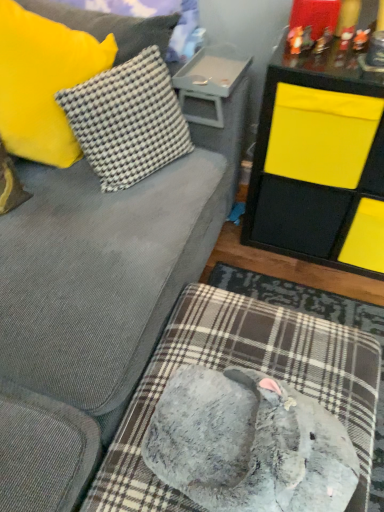
Locate an element on the screen. This screenshot has height=512, width=384. yellow fuzzy pillow at upper left, the 2th pillow positioned from the right is located at coordinates (43, 82).

Image resolution: width=384 pixels, height=512 pixels. What are the coordinates of `yellow matte storage unit at upper right, which is the second table in left-to-right order` in the screenshot? It's located at (319, 162).

The height and width of the screenshot is (512, 384). I want to click on gray plush dog bed at lower center, so click(x=247, y=367).

Based on their sizes in the image, would you say white checkered fabric pillow at upper left, the second pillow viewed from the left, is bigger or smaller than gray plush dog bed at lower center?

Considering their sizes, white checkered fabric pillow at upper left, the second pillow viewed from the left, takes up less space than gray plush dog bed at lower center.

Considering the relative sizes of white checkered fabric pillow at upper left, the 1th pillow positioned from the right, and gray plush dog bed at lower center in the image provided, is white checkered fabric pillow at upper left, the 1th pillow positioned from the right, taller than gray plush dog bed at lower center?

Correct, white checkered fabric pillow at upper left, the 1th pillow positioned from the right, is much taller as gray plush dog bed at lower center.

From the image's perspective, which one is positioned higher, white checkered fabric pillow at upper left, the 1th pillow positioned from the right, or gray plush dog bed at lower center?

From the image's view, white checkered fabric pillow at upper left, the 1th pillow positioned from the right, is above.

Considering the positions of objects plastic tray at upper center, positioned as the first table in left-to-right order, and yellow matte storage unit at upper right, which is the second table in left-to-right order, in the image provided, who is more to the right, plastic tray at upper center, positioned as the first table in left-to-right order, or yellow matte storage unit at upper right, which is the second table in left-to-right order,?

yellow matte storage unit at upper right, which is the second table in left-to-right order.

Where is `table that is behind the yellow matte storage unit at upper right, placed as the first table when sorted from right to left`? The height and width of the screenshot is (512, 384). table that is behind the yellow matte storage unit at upper right, placed as the first table when sorted from right to left is located at coordinates (209, 82).

From their relative heights in the image, would you say plastic tray at upper center, which is the second table from right to left, is taller or shorter than yellow matte storage unit at upper right, which is the second table in left-to-right order?

In the image, plastic tray at upper center, which is the second table from right to left, appears to be shorter than yellow matte storage unit at upper right, which is the second table in left-to-right order.

From the picture: Which of these two, plastic tray at upper center, which is the second table from right to left, or yellow matte storage unit at upper right, placed as the first table when sorted from right to left, is wider?

Wider between the two is yellow matte storage unit at upper right, placed as the first table when sorted from right to left.

What's the angular difference between plastic tray at upper center, which is the second table from right to left, and gray plush dog bed at lower center's facing directions?

There is a 89-degree angle between the facing directions of plastic tray at upper center, which is the second table from right to left, and gray plush dog bed at lower center.

From the image's perspective, does plastic tray at upper center, positioned as the first table in left-to-right order, appear higher than gray plush dog bed at lower center?

Correct, plastic tray at upper center, positioned as the first table in left-to-right order, appears higher than gray plush dog bed at lower center in the image.

Which of these two, plastic tray at upper center, positioned as the first table in left-to-right order, or gray plush dog bed at lower center, stands shorter?

plastic tray at upper center, positioned as the first table in left-to-right order.

Considering the relative positions of yellow matte storage unit at upper right, placed as the first table when sorted from right to left, and white checkered fabric pillow at upper left, the second pillow viewed from the left, in the image provided, is yellow matte storage unit at upper right, placed as the first table when sorted from right to left, to the left of white checkered fabric pillow at upper left, the second pillow viewed from the left, from the viewer's perspective?

Incorrect, yellow matte storage unit at upper right, placed as the first table when sorted from right to left, is not on the left side of white checkered fabric pillow at upper left, the second pillow viewed from the left.

Is point (343, 119) farther from viewer compared to point (120, 156)?

No.

Does yellow matte storage unit at upper right, which is the second table in left-to-right order, come in front of white checkered fabric pillow at upper left, the 1th pillow positioned from the right?

No.

From the image's perspective, is yellow matte storage unit at upper right, placed as the first table when sorted from right to left, on top of white checkered fabric pillow at upper left, the 1th pillow positioned from the right?

No, from the image's perspective, yellow matte storage unit at upper right, placed as the first table when sorted from right to left, is not on top of white checkered fabric pillow at upper left, the 1th pillow positioned from the right.

Is yellow matte storage unit at upper right, which is the second table in left-to-right order, next to gray plush dog bed at lower center and touching it?

yellow matte storage unit at upper right, which is the second table in left-to-right order, and gray plush dog bed at lower center are clearly separated.

From the image's perspective, would you say yellow matte storage unit at upper right, placed as the first table when sorted from right to left, is positioned over gray plush dog bed at lower center?

Indeed, from the image's perspective, yellow matte storage unit at upper right, placed as the first table when sorted from right to left, is shown above gray plush dog bed at lower center.

Which is in front, yellow matte storage unit at upper right, placed as the first table when sorted from right to left, or gray plush dog bed at lower center?

gray plush dog bed at lower center is closer to the camera.

Would you say yellow matte storage unit at upper right, which is the second table in left-to-right order, is inside or outside gray plush dog bed at lower center?

The correct answer is: outside.

Is gray plush dog bed at lower center not near yellow fuzzy pillow at upper left, the 2th pillow positioned from the right?

gray plush dog bed at lower center is actually quite close to yellow fuzzy pillow at upper left, the 2th pillow positioned from the right.

Based on the photo, can you tell me how much gray plush dog bed at lower center and yellow fuzzy pillow at upper left, the 1th pillow from the left, differ in facing direction?

They differ by 53 degrees in their facing directions.

Is gray plush dog bed at lower center taller than yellow fuzzy pillow at upper left, the 2th pillow positioned from the right?

Incorrect, the height of gray plush dog bed at lower center is not larger of that of yellow fuzzy pillow at upper left, the 2th pillow positioned from the right.

Is point (245, 300) closer or farther from the camera than point (28, 92)?

Point (245, 300).

Relative to plastic tray at upper center, positioned as the first table in left-to-right order, is white checkered fabric pillow at upper left, the second pillow viewed from the left, in front or behind?

white checkered fabric pillow at upper left, the second pillow viewed from the left, is in front of plastic tray at upper center, positioned as the first table in left-to-right order.

From a real-world perspective, which table is the 1st one underneath the white checkered fabric pillow at upper left, the second pillow viewed from the left? Please provide its 2D coordinates.

[(209, 82)]

From a real-world perspective, does white checkered fabric pillow at upper left, the 1th pillow positioned from the right, stand above plastic tray at upper center, positioned as the first table in left-to-right order?

Yes, from a real-world perspective, white checkered fabric pillow at upper left, the 1th pillow positioned from the right, is on top of plastic tray at upper center, positioned as the first table in left-to-right order.

From the image's perspective, is white checkered fabric pillow at upper left, the second pillow viewed from the left, over plastic tray at upper center, positioned as the first table in left-to-right order?

No.

From the image's perspective, count 1st pillows upward from the gray plush dog bed at lower center and point to it. Please provide its 2D coordinates.

[(128, 120)]

Locate an element on the screen. table that appears below the plastic tray at upper center, positioned as the first table in left-to-right order (from a real-world perspective) is located at coordinates (319, 162).

From the image, which object appears to be nearer to yellow matte storage unit at upper right, which is the second table in left-to-right order, plastic tray at upper center, which is the second table from right to left, or yellow fuzzy pillow at upper left, the 2th pillow positioned from the right?

Based on the image, plastic tray at upper center, which is the second table from right to left, appears to be nearer to yellow matte storage unit at upper right, which is the second table in left-to-right order.

In the scene shown: When comparing their distances from plastic tray at upper center, positioned as the first table in left-to-right order, does white checkered fabric pillow at upper left, the 1th pillow positioned from the right, or gray plush dog bed at lower center seem closer?

Among the two, white checkered fabric pillow at upper left, the 1th pillow positioned from the right, is located nearer to plastic tray at upper center, positioned as the first table in left-to-right order.

Looking at the image, which one is located closer to yellow fuzzy pillow at upper left, the 2th pillow positioned from the right, gray plush dog bed at lower center or white checkered fabric pillow at upper left, the 1th pillow positioned from the right?

Based on the image, white checkered fabric pillow at upper left, the 1th pillow positioned from the right, appears to be nearer to yellow fuzzy pillow at upper left, the 2th pillow positioned from the right.

Looking at the image, which one is located closer to yellow matte storage unit at upper right, placed as the first table when sorted from right to left, plastic tray at upper center, positioned as the first table in left-to-right order, or white checkered fabric pillow at upper left, the 1th pillow positioned from the right?

plastic tray at upper center, positioned as the first table in left-to-right order.

Looking at the image, which one is located closer to gray plush dog bed at lower center, plastic tray at upper center, positioned as the first table in left-to-right order, or white checkered fabric pillow at upper left, the 1th pillow positioned from the right?

white checkered fabric pillow at upper left, the 1th pillow positioned from the right, lies closer to gray plush dog bed at lower center than the other object.

Which object lies further to the anchor point gray plush dog bed at lower center, yellow matte storage unit at upper right, which is the second table in left-to-right order, or yellow fuzzy pillow at upper left, the 1th pillow from the left?

yellow fuzzy pillow at upper left, the 1th pillow from the left, is positioned further to the anchor gray plush dog bed at lower center.

Estimate the real-world distances between objects in this image. Which object is further from plastic tray at upper center, positioned as the first table in left-to-right order, yellow fuzzy pillow at upper left, the 2th pillow positioned from the right, or yellow matte storage unit at upper right, placed as the first table when sorted from right to left?

yellow fuzzy pillow at upper left, the 2th pillow positioned from the right, lies further to plastic tray at upper center, positioned as the first table in left-to-right order, than the other object.

When comparing their distances from gray plush dog bed at lower center, does yellow fuzzy pillow at upper left, the 2th pillow positioned from the right, or plastic tray at upper center, which is the second table from right to left, seem closer?

yellow fuzzy pillow at upper left, the 2th pillow positioned from the right, is positioned closer to the anchor gray plush dog bed at lower center.

Locate an element on the screen. pillow between yellow fuzzy pillow at upper left, the 2th pillow positioned from the right, and yellow matte storage unit at upper right, which is the second table in left-to-right order is located at coordinates (128, 120).

The width and height of the screenshot is (384, 512). I want to click on pillow between yellow fuzzy pillow at upper left, the 2th pillow positioned from the right, and gray plush dog bed at lower center, in the vertical direction, so click(x=128, y=120).

Find the location of a particular element. The height and width of the screenshot is (512, 384). pillow between yellow fuzzy pillow at upper left, the 1th pillow from the left, and plastic tray at upper center, which is the second table from right to left, from left to right is located at coordinates (128, 120).

Identify the location of table between plastic tray at upper center, positioned as the first table in left-to-right order, and gray plush dog bed at lower center from top to bottom. Image resolution: width=384 pixels, height=512 pixels. [319, 162].